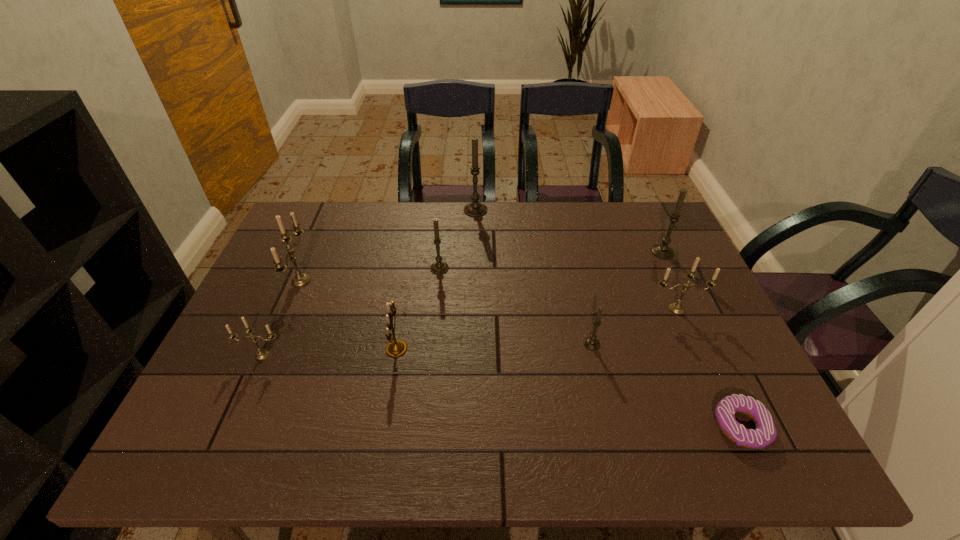
Find the location of `free space that is in between the second biggest metallic candle and the biggest metallic candle`. free space that is in between the second biggest metallic candle and the biggest metallic candle is located at coordinates (489, 295).

Locate an element on the screen. The image size is (960, 540). unoccupied position between the nearest metallic candle and the tallest object is located at coordinates (369, 282).

Image resolution: width=960 pixels, height=540 pixels. I want to click on unoccupied position between the second smallest metallic candle and the biggest metallic candle, so click(x=489, y=295).

Locate an element on the screen. The width and height of the screenshot is (960, 540). free point between the tallest object and the nearest gray candle is located at coordinates (534, 277).

Identify the location of vacant area that lies between the smallest metallic candle and the farthest gray candle. This screenshot has width=960, height=540. (369, 282).

Identify which object is the fifth closest to the fifth candle from right to left. Please provide its 2D coordinates. Your answer should be formatted as a tuple, i.e. [(x, y)], where the tuple contains the x and y coordinates of a point satisfying the conditions above.

[(261, 354)]

This screenshot has height=540, width=960. I want to click on the sixth closest object to the biggest gray candle, so click(677, 308).

Select which candle is the sixth closest to the biggest metallic candle. Please provide its 2D coordinates. Your answer should be formatted as a tuple, i.e. [(x, y)], where the tuple contains the x and y coordinates of a point satisfying the conditions above.

[(663, 251)]

In order to click on candle that is the second closest to the nearest object in this screenshot , I will do `click(677, 308)`.

This screenshot has height=540, width=960. Find the location of `gray candle identified as the second closest to the rightmost metallic candle`. gray candle identified as the second closest to the rightmost metallic candle is located at coordinates (663, 251).